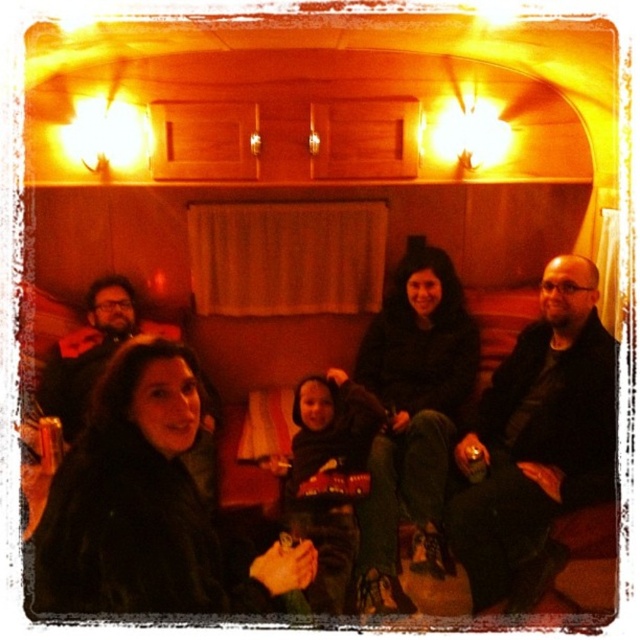
You are standing in the room and want to hand a drink to both the person wearing the black leather jacket at center and the person wearing the matte black jacket at left. Which jacket is closer to your current position?

The matte black jacket at left is closer to your current position because the black leather jacket at center is to the right of it, meaning it is further away from you.